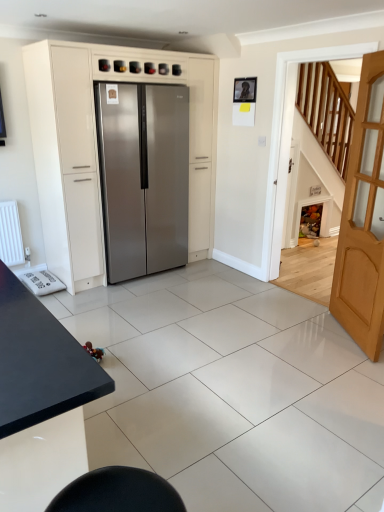
Question: Is light brown wooden door at right to the right of satin silver refrigerator at center from the viewer's perspective?

Choices:
 (A) no
 (B) yes

Answer: (B)

Question: Is light brown wooden door at right behind satin silver refrigerator at center?

Choices:
 (A) yes
 (B) no

Answer: (B)

Question: Can we say light brown wooden door at right lies outside satin silver refrigerator at center?

Choices:
 (A) no
 (B) yes

Answer: (B)

Question: From a real-world perspective, is light brown wooden door at right physically below satin silver refrigerator at center?

Choices:
 (A) yes
 (B) no

Answer: (A)

Question: Is light brown wooden door at right shorter than satin silver refrigerator at center?

Choices:
 (A) yes
 (B) no

Answer: (A)

Question: Based on their sizes in the image, would you say black matte table at lower left is bigger or smaller than light brown wooden door at right?

Choices:
 (A) big
 (B) small

Answer: (A)

Question: Is black matte table at lower left spatially inside light brown wooden door at right, or outside of it?

Choices:
 (A) outside
 (B) inside

Answer: (A)

Question: Is point (48, 493) closer or farther from the camera than point (352, 254)?

Choices:
 (A) closer
 (B) farther

Answer: (A)

Question: From the image's perspective, is black matte table at lower left positioned above or below light brown wooden door at right?

Choices:
 (A) above
 (B) below

Answer: (B)

Question: Considering the positions of light brown wooden door at right and satin silver refrigerator at center in the image, is light brown wooden door at right bigger or smaller than satin silver refrigerator at center?

Choices:
 (A) small
 (B) big

Answer: (A)

Question: From their relative heights in the image, would you say light brown wooden door at right is taller or shorter than satin silver refrigerator at center?

Choices:
 (A) tall
 (B) short

Answer: (B)

Question: In the image, is light brown wooden door at right on the left side or the right side of satin silver refrigerator at center?

Choices:
 (A) left
 (B) right

Answer: (B)

Question: Do you think light brown wooden door at right is within satin silver refrigerator at center, or outside of it?

Choices:
 (A) inside
 (B) outside

Answer: (B)

Question: In terms of height, does stainless steel refrigerator at center look taller or shorter compared to satin silver refrigerator at center?

Choices:
 (A) short
 (B) tall

Answer: (A)

Question: From the image's perspective, is stainless steel refrigerator at center above or below satin silver refrigerator at center?

Choices:
 (A) above
 (B) below

Answer: (B)